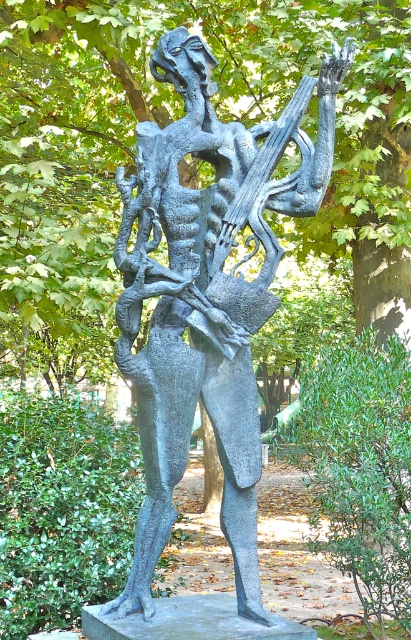
Does green leafy tree at upper center have a lesser height compared to bronze textured sculpture at center?

Incorrect, green leafy tree at upper center's height does not fall short of bronze textured sculpture at center's.

Which is more to the left, green leafy tree at upper center or bronze textured sculpture at center?

bronze textured sculpture at center is more to the left.

Does point (374, 276) come farther from viewer compared to point (247, 600)?

That is True.

Where is `green leafy tree at upper center`? green leafy tree at upper center is located at coordinates (256, 106).